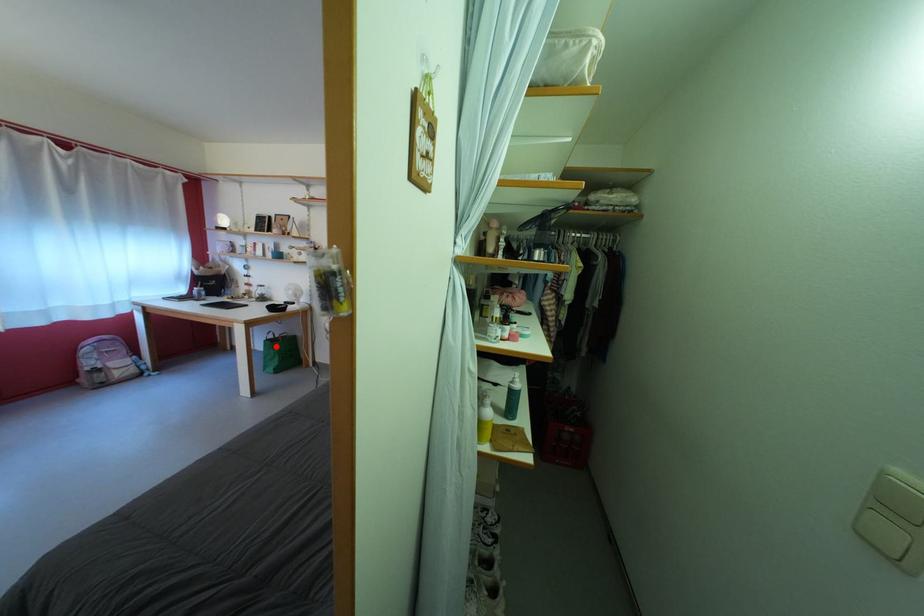
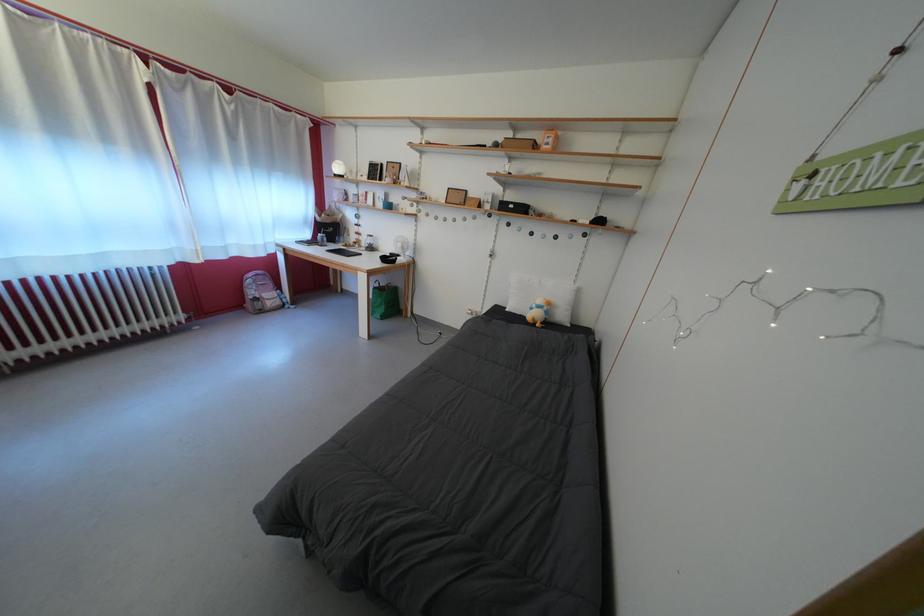
Locate, in the second image, the point that corresponds to the highlighted location in the first image.

(383, 294)